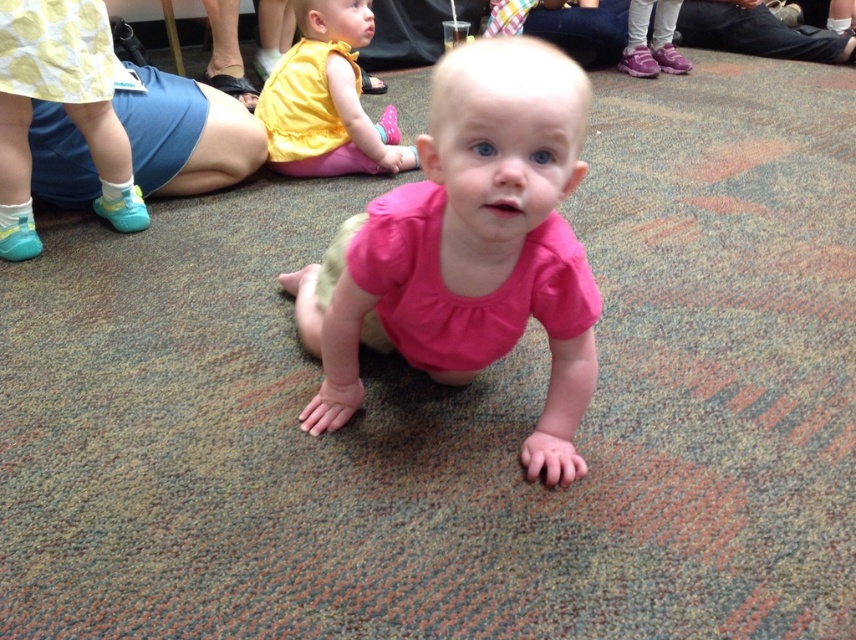
Describe the element at coordinates (474, 248) in the screenshot. Image resolution: width=856 pixels, height=640 pixels. I see `pink fabric toddler at center` at that location.

Is point (431, 276) positioned behind point (302, 93)?

No.

Identify the location of pink fabric toddler at center. The image size is (856, 640). (474, 248).